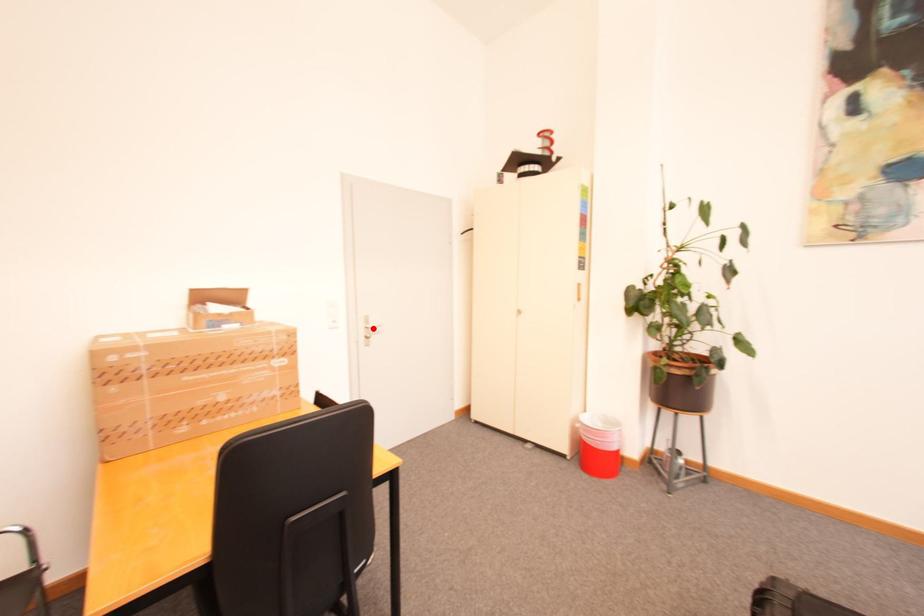
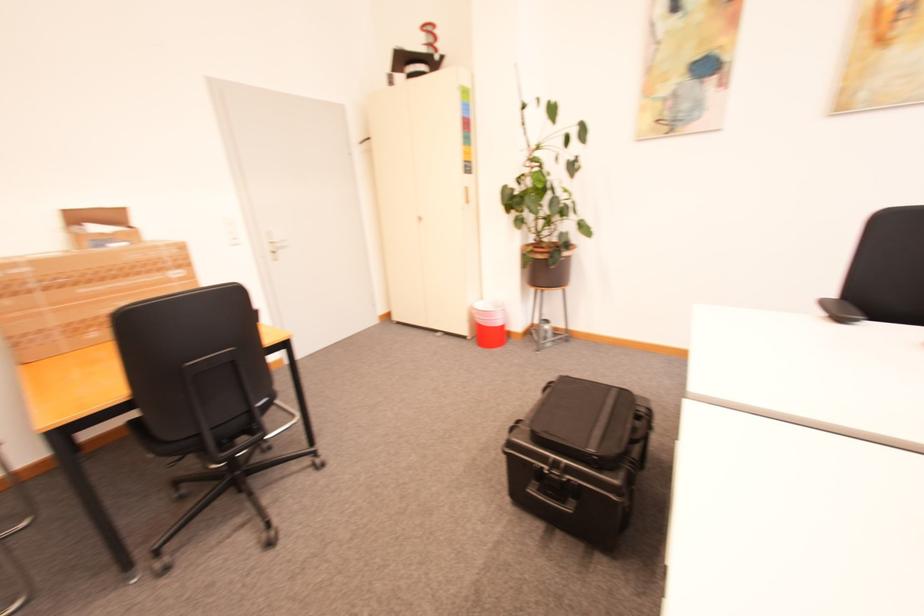
The point at the highlighted location is marked in the first image. Where is the corresponding point in the second image?

(277, 244)